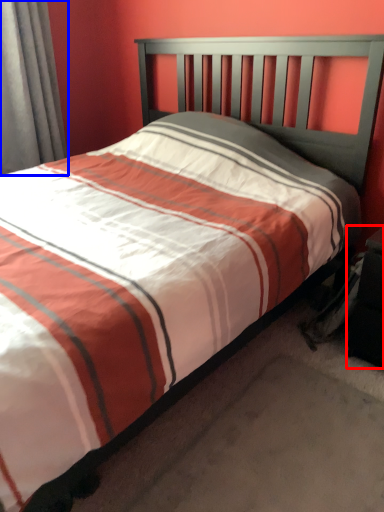
Question: Which object is closer to the camera taking this photo, nightstand (highlighted by a red box) or curtain (highlighted by a blue box)?

Choices:
 (A) nightstand
 (B) curtain

Answer: (A)